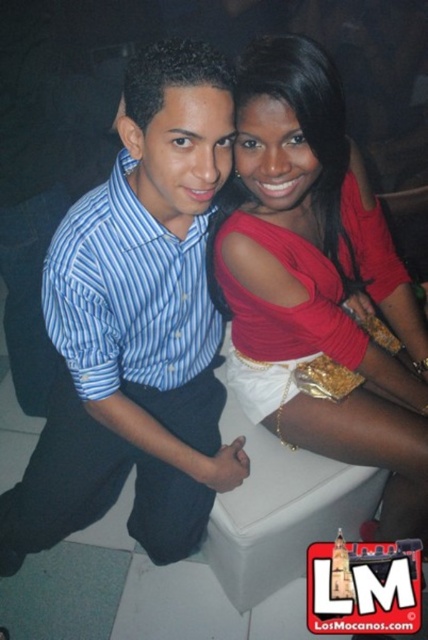
You are at a party and want to introduce yourself to the person wearing the blue striped shirt at left. Which direction should you walk relative to the matte red blouse at center?

The matte red blouse at center is positioned on the right side of the blue striped shirt at left. To reach the blue striped shirt at left from the matte red blouse at center, you should walk to the left.

You are at a party and want to hand a drink to both the matte red blouse at center and the blue striped shirt at left. Which person should you approach first if you want to give the drink to the one closer to the stage in the lower right corner?

The matte red blouse at center is positioned under the blue striped shirt at left, meaning it is closer to the stage in the lower right corner. Therefore, you should approach the matte red blouse at center first.

You are a photographer at the event and need to capture a closeup shot of both the matte red blouse at center and the blue striped shirt at left. Given that your camera has a focus range of 9 inches, will you be able to capture both subjects in focus?

The matte red blouse at center and blue striped shirt at left are 9.30 inches apart. Since the camera has a focus range of 9 inches, the distance between them exceeds the focus range, so both subjects cannot be captured in focus simultaneously.